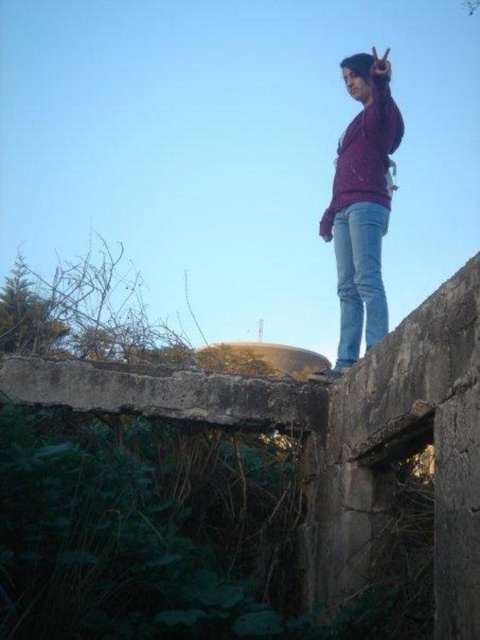
Question: Which of these objects is positioned closest to the matte purple sweatshirt at center?

Choices:
 (A) jeans at upper right
 (B) concrete at upper center
 (C) purple matte sweater at upper center

Answer: (A)

Question: Is purple matte sweater at upper center to the left of matte purple sweatshirt at center from the viewer's perspective?

Choices:
 (A) no
 (B) yes

Answer: (B)

Question: Estimate the real-world distances between objects in this image. Which object is farther from the concrete at upper center?

Choices:
 (A) matte purple sweatshirt at center
 (B) jeans at upper right

Answer: (A)

Question: Is concrete at upper center positioned before purple matte sweater at upper center?

Choices:
 (A) no
 (B) yes

Answer: (B)

Question: Is concrete at upper center above jeans at upper right?

Choices:
 (A) yes
 (B) no

Answer: (B)

Question: Which object is farther from the camera taking this photo?

Choices:
 (A) purple matte sweater at upper center
 (B) concrete at upper center
 (C) jeans at upper right
 (D) matte purple sweatshirt at center

Answer: (A)